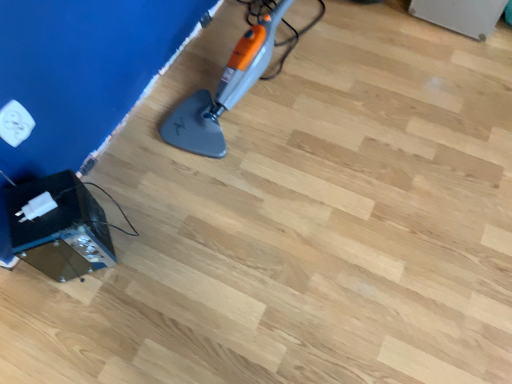
Identify the location of white plastic power plugs and sockets at lower left. [x=15, y=123].

The height and width of the screenshot is (384, 512). Describe the element at coordinates (15, 123) in the screenshot. I see `white plastic power plugs and sockets at lower left` at that location.

Where is `white plastic power plugs and sockets at lower left`? The height and width of the screenshot is (384, 512). white plastic power plugs and sockets at lower left is located at coordinates (15, 123).